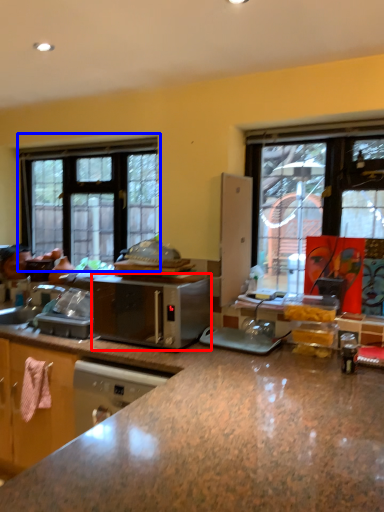
Question: Which object is closer to the camera taking this photo, microwave oven (highlighted by a red box) or window (highlighted by a blue box)?

Choices:
 (A) microwave oven
 (B) window

Answer: (A)